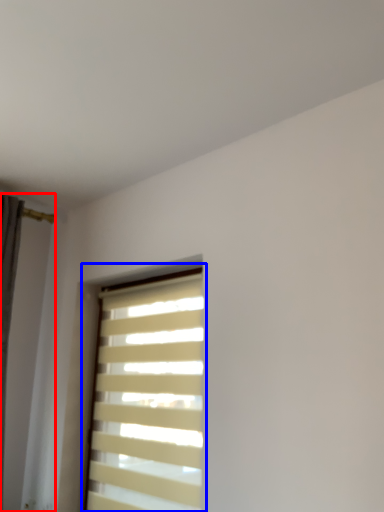
Question: Which object appears farthest to the camera in this image, shutter (highlighted by a red box) or window blind (highlighted by a blue box)?

Choices:
 (A) shutter
 (B) window blind

Answer: (B)